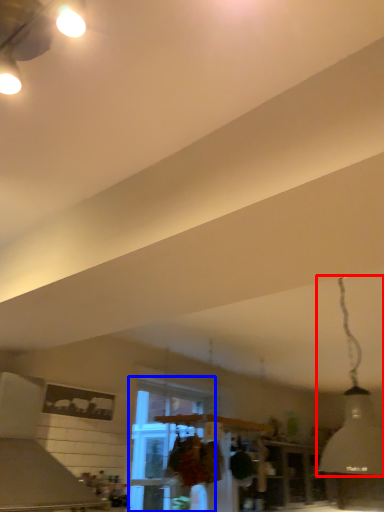
Question: Which point is closer to the camera, lamp (highlighted by a red box) or window (highlighted by a blue box)?

Choices:
 (A) lamp
 (B) window

Answer: (A)